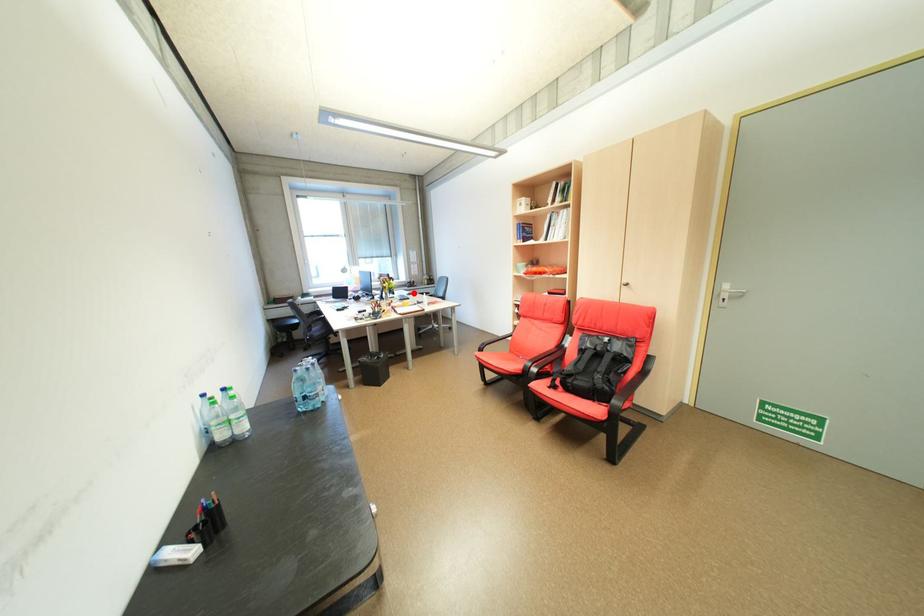
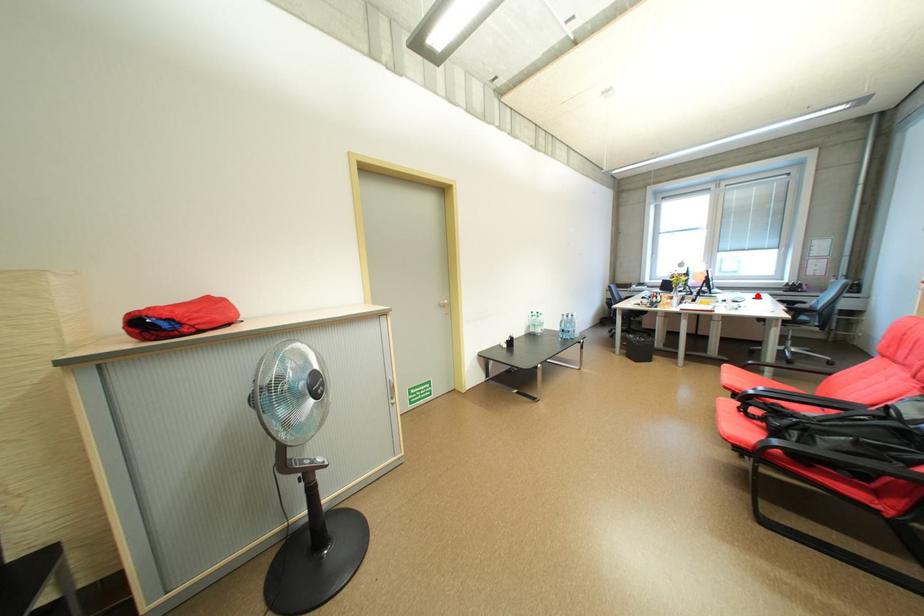
I am providing you with two images of the same scene from different viewpoints. A red point is marked on the first image and another point is marked on the second image. Is the red point in image1 aligned with the point shown in image2?

Yes